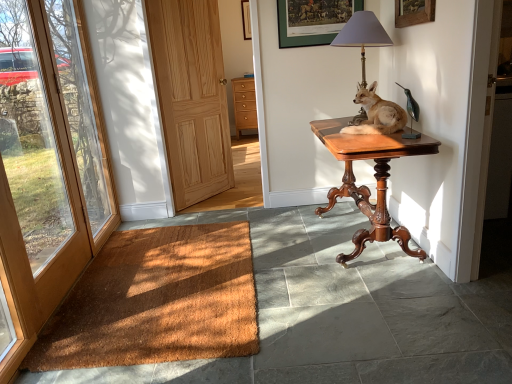
Question: Is mahogany wood table at center positioned in front of green matte picture frame at upper center, acting as the first picture frame starting from the bottom?

Choices:
 (A) yes
 (B) no

Answer: (A)

Question: Can you confirm if mahogany wood table at center is taller than green matte picture frame at upper center, acting as the first picture frame starting from the bottom?

Choices:
 (A) no
 (B) yes

Answer: (B)

Question: Could you tell me if mahogany wood table at center is turned towards green matte picture frame at upper center, which ranks as the second picture frame in top-to-bottom order?

Choices:
 (A) yes
 (B) no

Answer: (B)

Question: Is mahogany wood table at center smaller than green matte picture frame at upper center, which ranks as the second picture frame in top-to-bottom order?

Choices:
 (A) no
 (B) yes

Answer: (A)

Question: From a real-world perspective, is mahogany wood table at center positioned under green matte picture frame at upper center, which ranks as the second picture frame in top-to-bottom order, based on gravity?

Choices:
 (A) no
 (B) yes

Answer: (B)

Question: Considering the relative positions of brown coir doormat at lower left and light wood/dark finish cabinet at center in the image provided, is brown coir doormat at lower left to the left or to the right of light wood/dark finish cabinet at center?

Choices:
 (A) right
 (B) left

Answer: (B)

Question: From the image's perspective, relative to light wood/dark finish cabinet at center, is brown coir doormat at lower left above or below?

Choices:
 (A) above
 (B) below

Answer: (B)

Question: From a real-world perspective, is brown coir doormat at lower left above or below light wood/dark finish cabinet at center?

Choices:
 (A) above
 (B) below

Answer: (B)

Question: Looking at the image, does brown coir doormat at lower left seem bigger or smaller compared to light wood/dark finish cabinet at center?

Choices:
 (A) big
 (B) small

Answer: (B)

Question: From the image's perspective, is light brown wood door at center, the 2th door positioned from the front, located above or below wooden picture frame at upper center, which appears as the 1th picture frame when viewed from the top?

Choices:
 (A) below
 (B) above

Answer: (A)

Question: Choose the correct answer: Is light brown wood door at center, the 2th door when ordered from left to right, inside wooden picture frame at upper center, acting as the 2th picture frame starting from the right, or outside it?

Choices:
 (A) outside
 (B) inside

Answer: (A)

Question: From a real-world perspective, is light brown wood door at center, the 1th door positioned from the right, physically located above or below wooden picture frame at upper center, acting as the 1th picture frame starting from the back?

Choices:
 (A) above
 (B) below

Answer: (B)

Question: In terms of size, does light brown wood door at center, the 2th door positioned from the front, appear bigger or smaller than wooden picture frame at upper center, which appears as the 1th picture frame when viewed from the left?

Choices:
 (A) small
 (B) big

Answer: (B)

Question: From the image's perspective, is wooden picture frame at upper center, placed as the 2th picture frame when sorted from bottom to top, positioned above or below light brown wood door at center, the 1th door positioned from the right?

Choices:
 (A) above
 (B) below

Answer: (A)

Question: Which is correct: wooden picture frame at upper center, acting as the 1th picture frame starting from the back, is inside light brown wood door at center, the 1th door positioned from the right, or outside of it?

Choices:
 (A) outside
 (B) inside

Answer: (A)